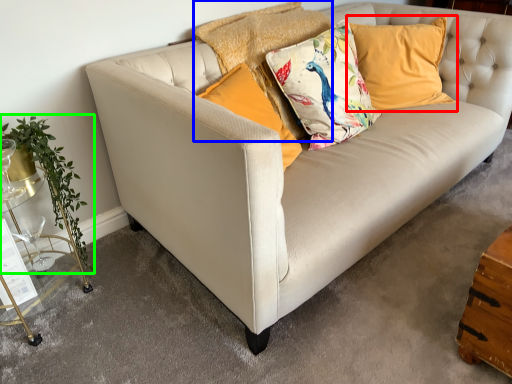
Question: Which object is the closest to the pillow (highlighted by a red box)? Choose among these: pillow (highlighted by a blue box) or plant (highlighted by a green box).

Choices:
 (A) pillow
 (B) plant

Answer: (A)